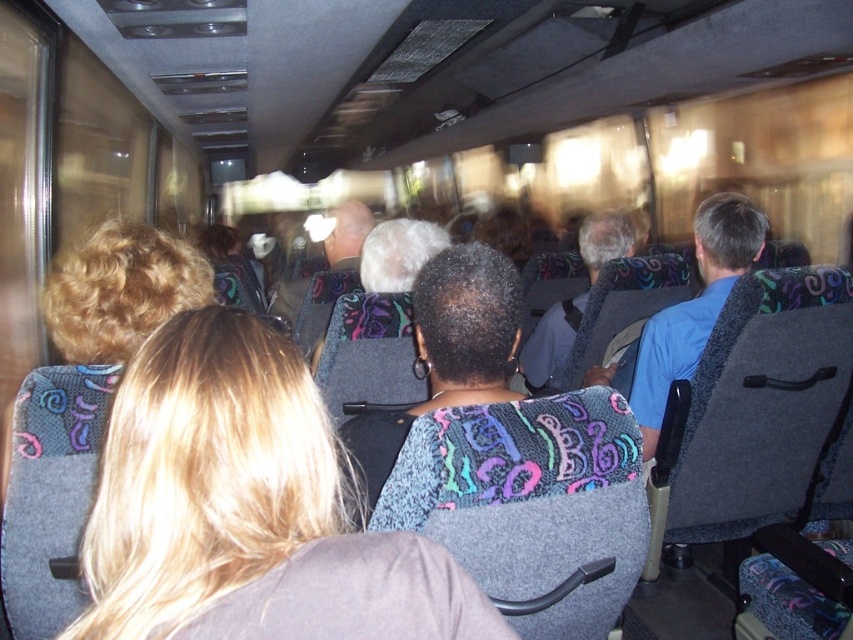
Is point (312, 536) positioned behind point (564, 308)?

No, it is not.

Between blonde hair at center and gray fabric jacket at center, which one is positioned higher?

gray fabric jacket at center is higher up.

Between point (320, 488) and point (531, 362), which one is positioned in front?

Positioned in front is point (320, 488).

Find the location of a particular element. The width and height of the screenshot is (853, 640). blonde hair at center is located at coordinates (247, 508).

Who is shorter, blonde hair at center or multicolored fabric headrest at center?

blonde hair at center is shorter.

Between blonde hair at center and multicolored fabric headrest at center, which one appears on the left side from the viewer's perspective?

Positioned to the left is blonde hair at center.

This screenshot has width=853, height=640. In order to click on blonde hair at center in this screenshot , I will do `click(247, 508)`.

Is multicolored fabric headrest at center further to the viewer compared to gray fabric jacket at center?

No, it is in front of gray fabric jacket at center.

Is multicolored fabric headrest at center below gray fabric jacket at center?

Indeed, multicolored fabric headrest at center is positioned under gray fabric jacket at center.

Which is in front, point (514, 292) or point (519, 365)?

Positioned in front is point (514, 292).

This screenshot has width=853, height=640. Find the location of `multicolored fabric headrest at center`. multicolored fabric headrest at center is located at coordinates (445, 353).